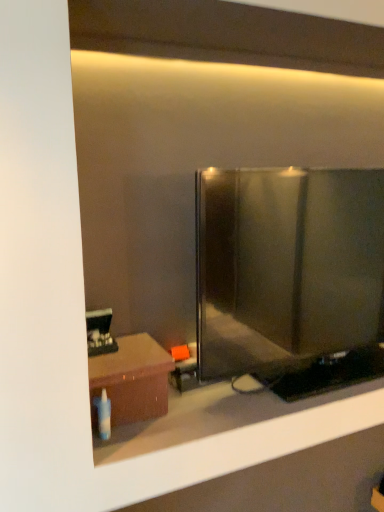
The height and width of the screenshot is (512, 384). I want to click on free location above brown matte table at lower left (from a real-world perspective), so click(120, 350).